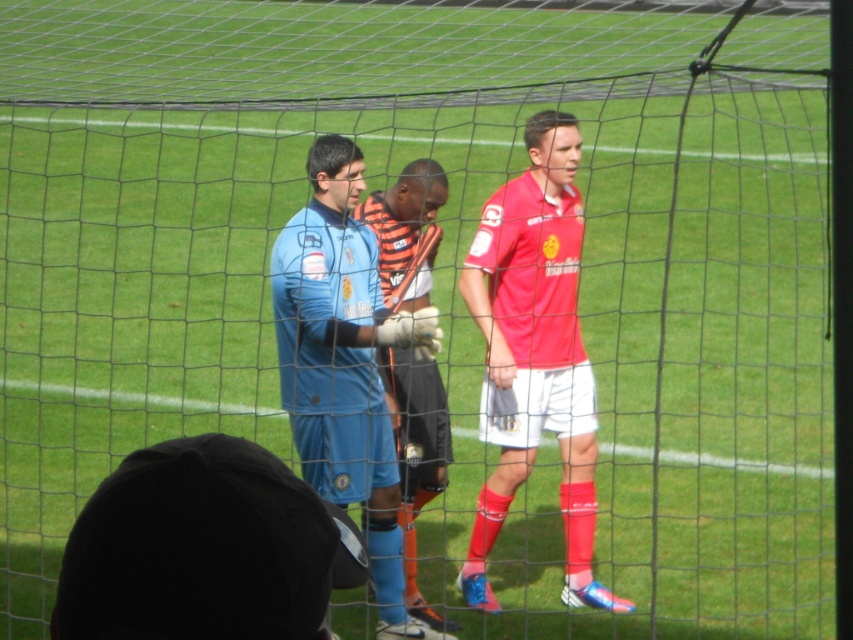
You are a soccer fan watching the match through the netting. You notice two players in the background through the netting barrier. Which player, the matte red jersey at center or the blue matte jersey at center, is positioned higher in the frame?

The matte red jersey at center is positioned higher in the frame than the blue matte jersey at center.

You are a spectator at a soccer match and want to know the position of the blue jersey at center relative to the matte red jersey at center. Which one is lower in the image?

The blue jersey at center is located below the matte red jersey at center, so the blue jersey at center is lower in the image.